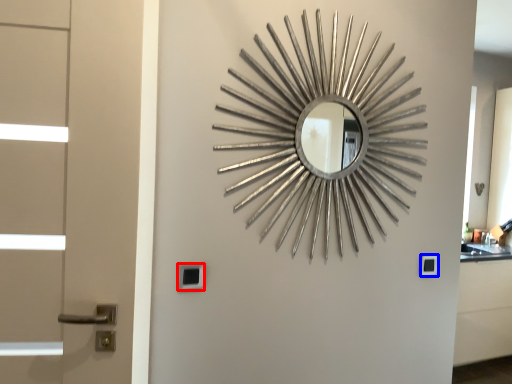
Question: Which object is closer to the camera taking this photo, lock (highlighted by a red box) or lock (highlighted by a blue box)?

Choices:
 (A) lock
 (B) lock

Answer: (A)